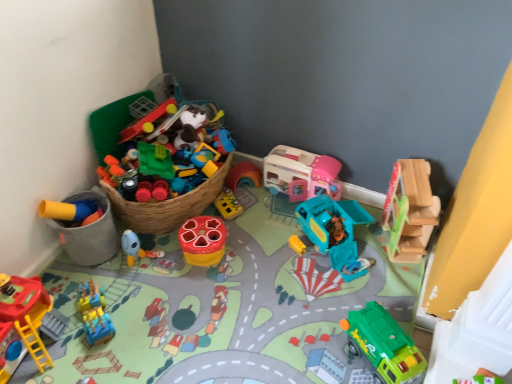
The height and width of the screenshot is (384, 512). I want to click on vacant space that's between green matte truck at lower right, arranged as the second toy when viewed from the right, and wooden slide at upper right, arranged as the first toy when viewed from the right, so click(x=382, y=283).